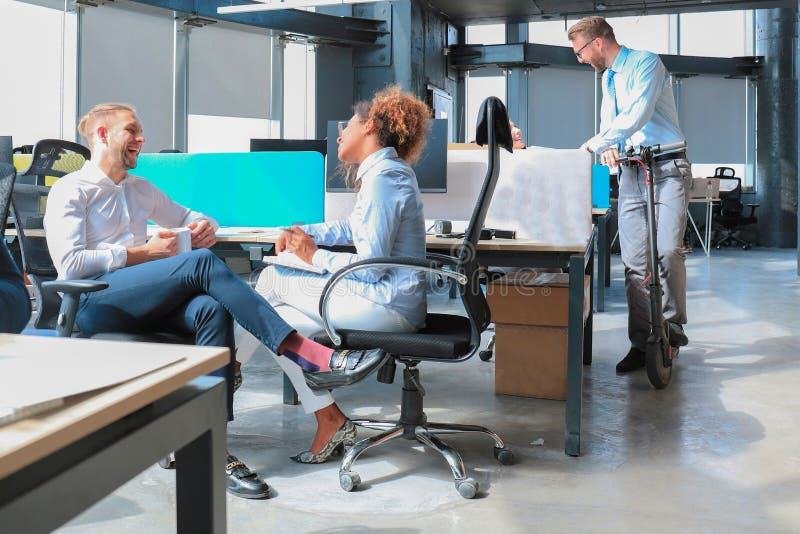
Where is `concrete floor with shadows and a piece of rolled paper`? Image resolution: width=800 pixels, height=534 pixels. concrete floor with shadows and a piece of rolled paper is located at coordinates (762, 303), (764, 505), (538, 451), (764, 259).